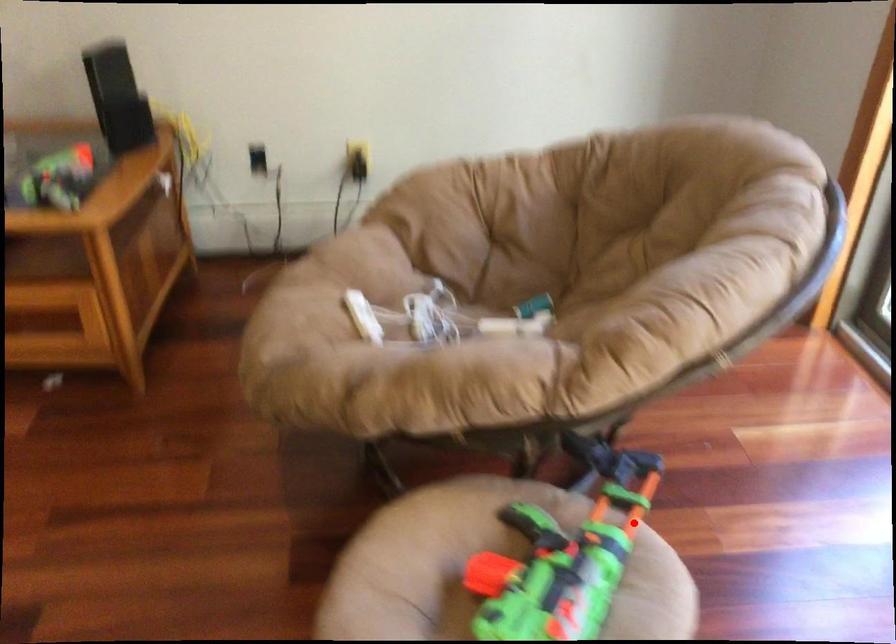
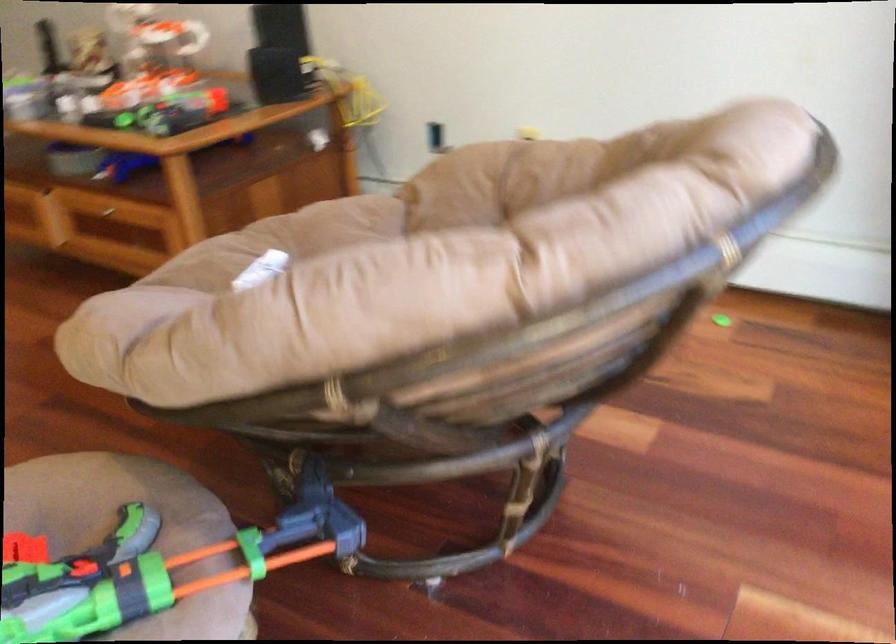
In the second image, find the point that corresponds to the highlighted location in the first image.

(159, 567)